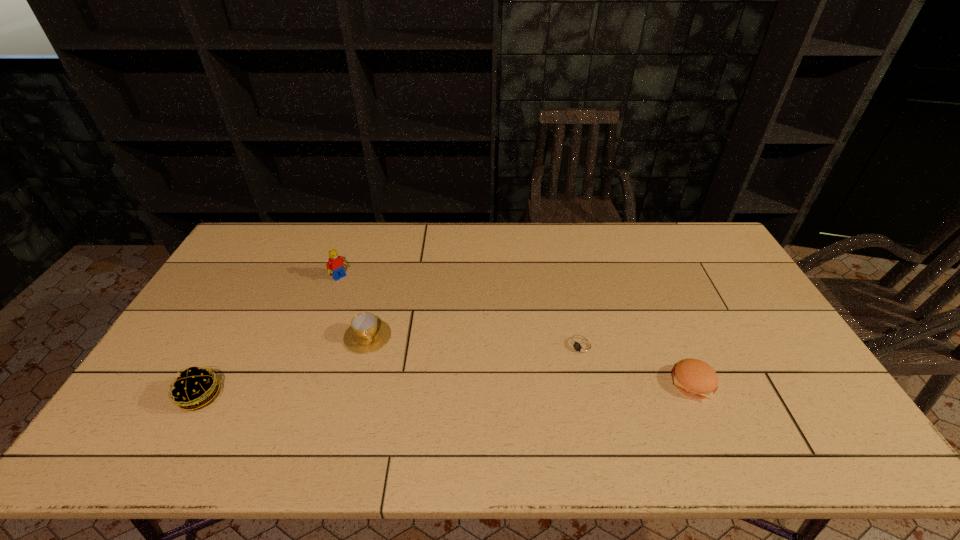
The width and height of the screenshot is (960, 540). In order to click on free space on the desktop that is between the taller patty and the right patty and is positioned with the handle on the side of the third object from left to right in this screenshot , I will do `click(387, 392)`.

The width and height of the screenshot is (960, 540). I want to click on vacant space on the desktop that is between the left patty and the rightmost object and is positioned on the face of the second object from right to left, so click(518, 388).

I want to click on vacant space on the desktop that is between the taller patty and the rightmost object and is positioned on the face of the second object from left to right, so click(467, 389).